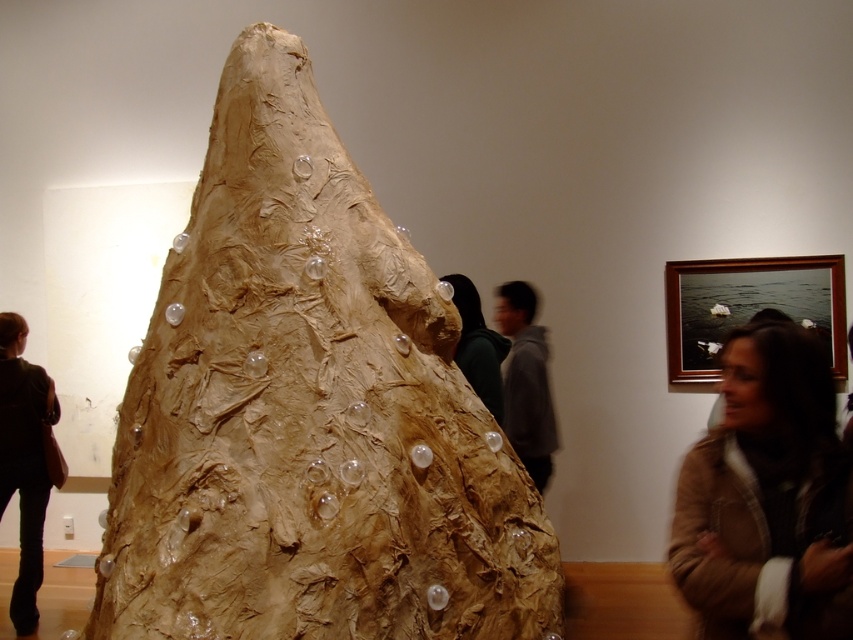
Question: Can you confirm if matte brown sculpture at center is positioned to the right of brown textured jacket at lower right?

Choices:
 (A) no
 (B) yes

Answer: (A)

Question: Is matte brown sculpture at center wider than brown textured jacket at lower right?

Choices:
 (A) yes
 (B) no

Answer: (A)

Question: Which point is closer to the camera taking this photo?

Choices:
 (A) (303, 68)
 (B) (712, 632)

Answer: (B)

Question: Which point is farther from the camera taking this photo?

Choices:
 (A) (305, 456)
 (B) (788, 410)

Answer: (A)

Question: Does matte brown sculpture at center appear on the right side of brown textured jacket at lower right?

Choices:
 (A) no
 (B) yes

Answer: (A)

Question: Which of the following is the closest to the observer?

Choices:
 (A) (773, 564)
 (B) (209, 461)

Answer: (A)